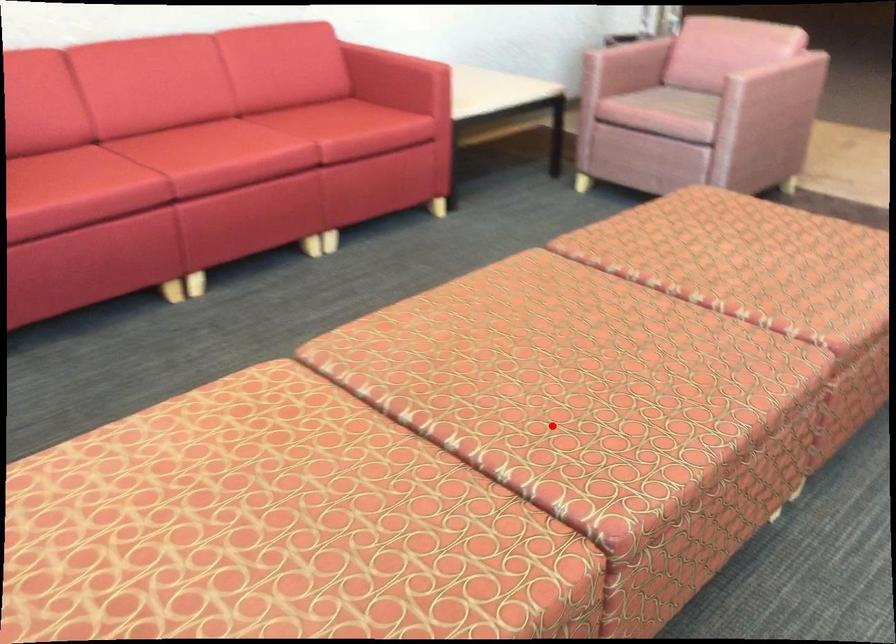
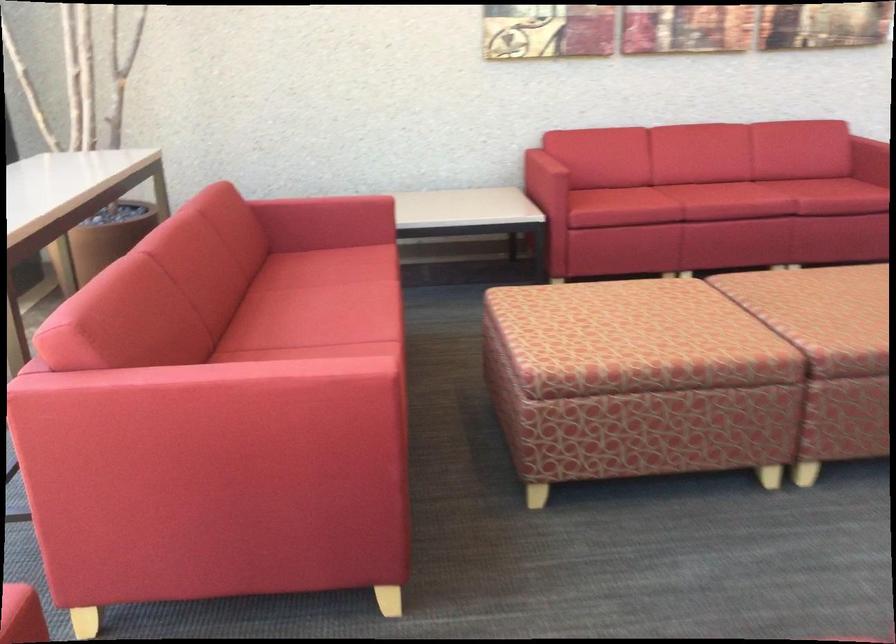
Question: I am providing you with two images of the same scene from different viewpoints. Image1 has a red point marked. In image2, the corresponding 3D location appears at what relative position? Reply with the corresponding letter.

Choices:
 (A) Closer
 (B) Farther

Answer: (B)